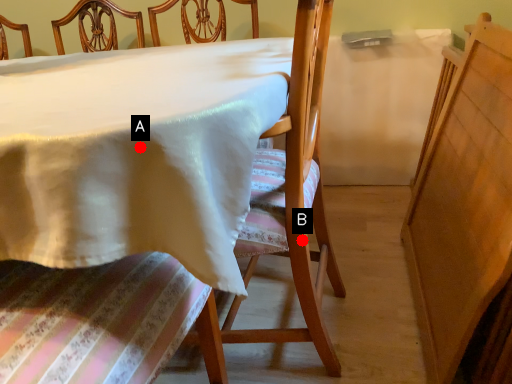
Question: Two points are circled on the image, labeled by A and B beside each circle. Which point is closer to the camera taking this photo?

Choices:
 (A) A is closer
 (B) B is closer

Answer: (A)